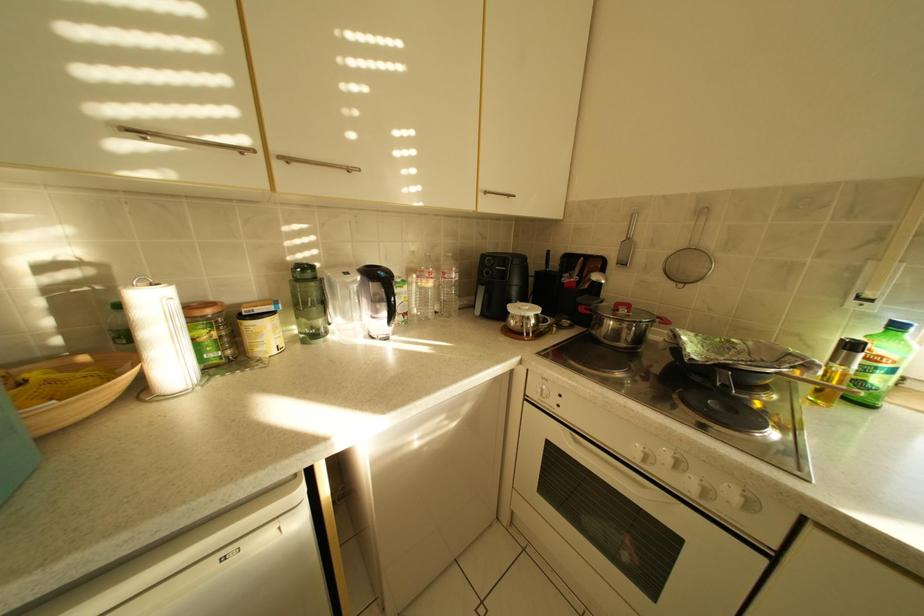
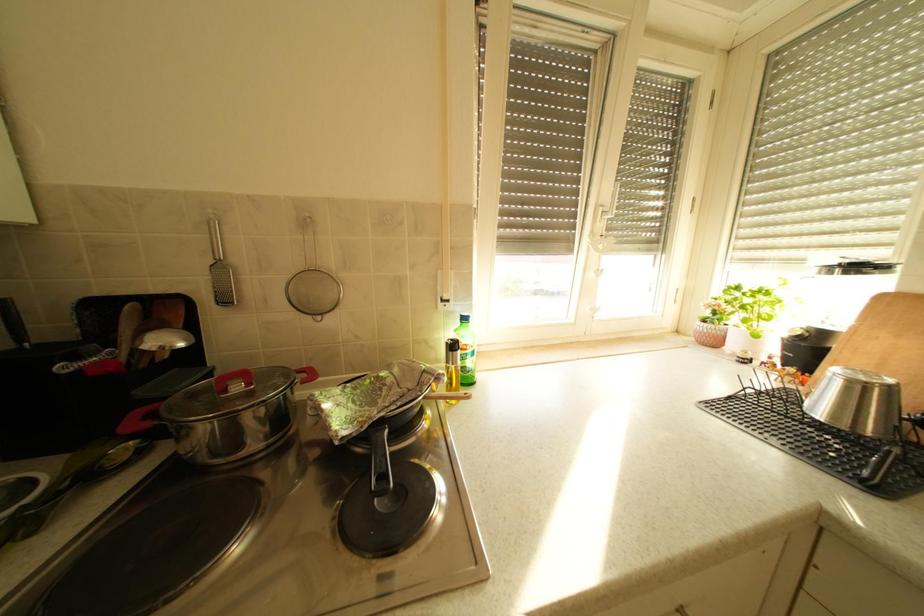
Question: The camera is either moving clockwise (left) or counter-clockwise (right) around the object. The first image is from the beginning of the video and the second image is from the end. Is the camera moving left or right when shooting the video?

Choices:
 (A) Left
 (B) Right

Answer: (A)